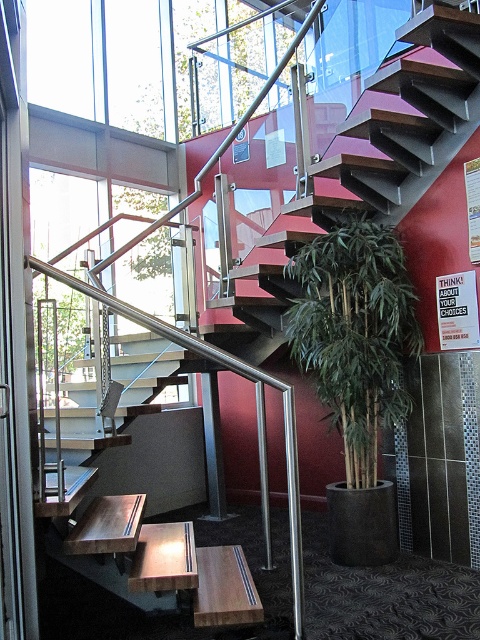
Question: Which point is closer to the camera?

Choices:
 (A) wooden bench at lower center
 (B) green bamboo at center

Answer: (A)

Question: Can you confirm if green bamboo at center is positioned below wooden bench at lower center?

Choices:
 (A) no
 (B) yes

Answer: (A)

Question: Can you confirm if green bamboo at center is thinner than wooden bench at lower center?

Choices:
 (A) no
 (B) yes

Answer: (A)

Question: Which point is closer to the camera?

Choices:
 (A) (224, 604)
 (B) (334, 385)

Answer: (A)

Question: Is green bamboo at center to the left of wooden bench at lower center from the viewer's perspective?

Choices:
 (A) yes
 (B) no

Answer: (B)